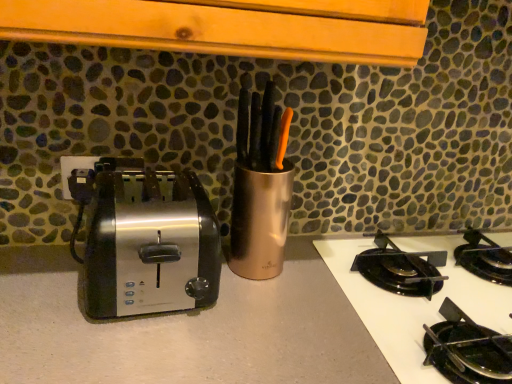
Question: From the image's perspective, is satin metallic toaster at left located above or below black glass cooktop at lower right?

Choices:
 (A) above
 (B) below

Answer: (A)

Question: Considering their positions, is satin metallic toaster at left located in front of or behind black glass cooktop at lower right?

Choices:
 (A) behind
 (B) front

Answer: (A)

Question: Which object is the farthest from the satin finish countertop at center?

Choices:
 (A) black glass cooktop at lower right
 (B) satin metallic toaster at left

Answer: (A)

Question: Based on their relative distances, which object is nearer to the satin metallic toaster at left?

Choices:
 (A) black glass cooktop at lower right
 (B) satin finish countertop at center

Answer: (B)